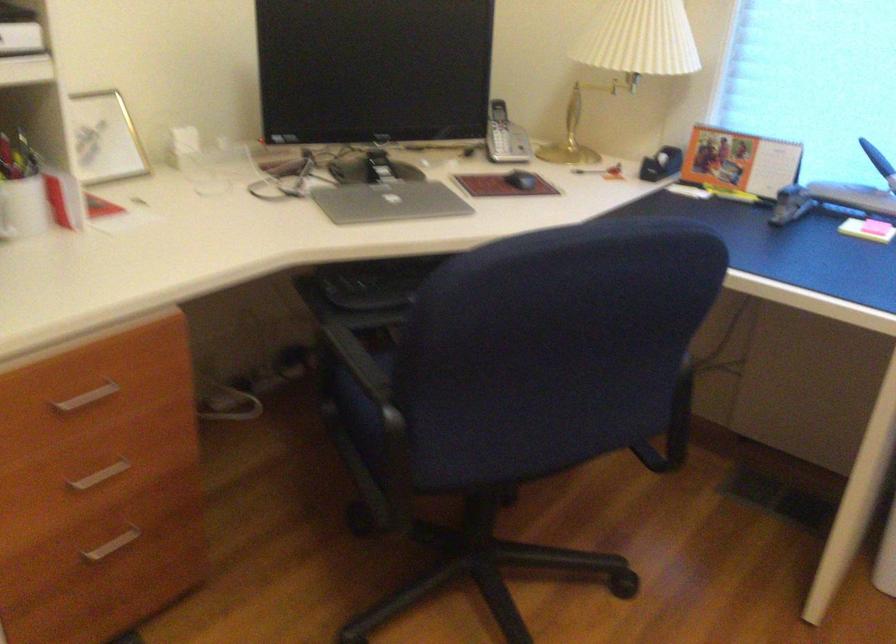
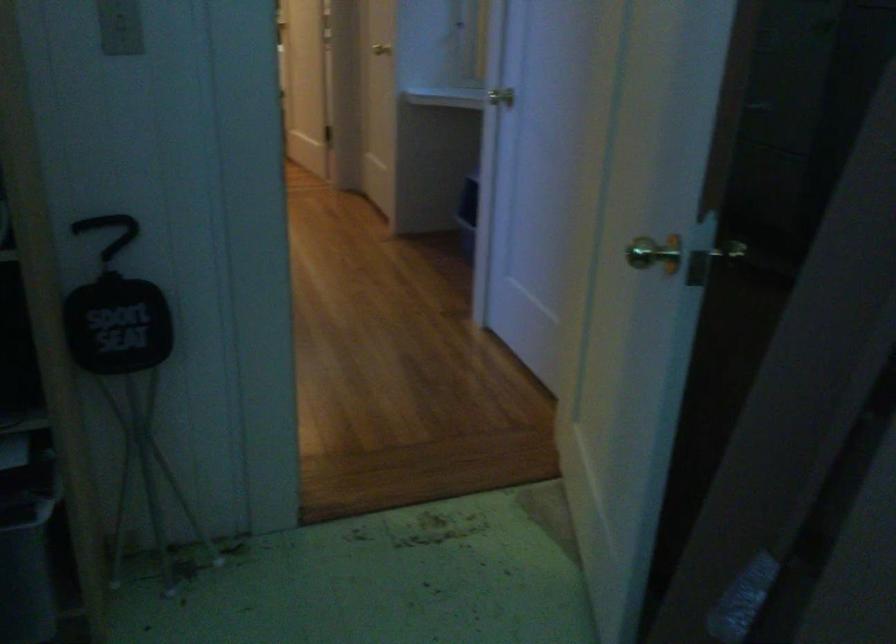
Question: I am providing you with two images of the same scene from different viewpoints. Which of the following objects are not visible in image2?

Choices:
 (A) brass door handle
 (B) silver drawer handle
 (C) 新物体
 (D) chair sitting surface

Answer: (B)